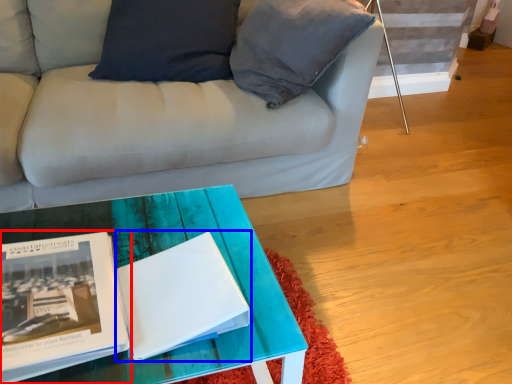
Question: Which point is further to the camera, book (highlighted by a red box) or magazine (highlighted by a blue box)?

Choices:
 (A) book
 (B) magazine

Answer: (B)